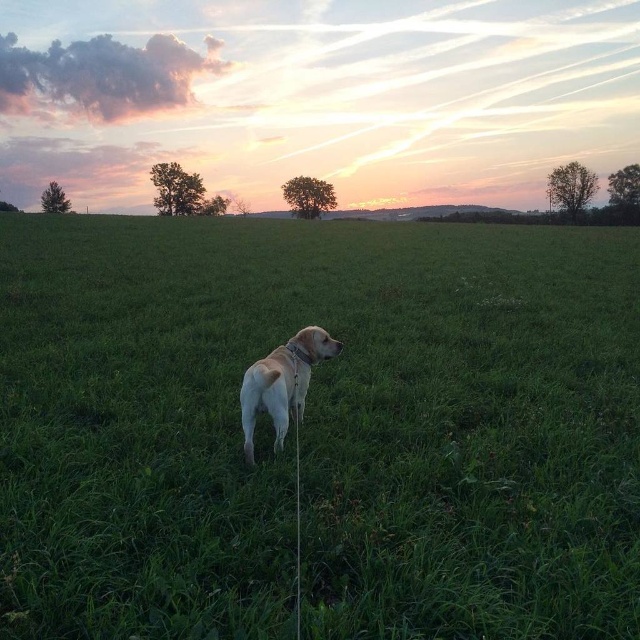
Consider the image. Does yellow fur dog at center have a lesser width compared to light yellow fur at center?

In fact, yellow fur dog at center might be wider than light yellow fur at center.

Does yellow fur dog at center appear on the left side of light yellow fur at center?

No, yellow fur dog at center is not to the left of light yellow fur at center.

Identify the location of yellow fur dog at center. The image size is (640, 640). (317, 429).

Identify the location of yellow fur dog at center. This screenshot has height=640, width=640. (317, 429).